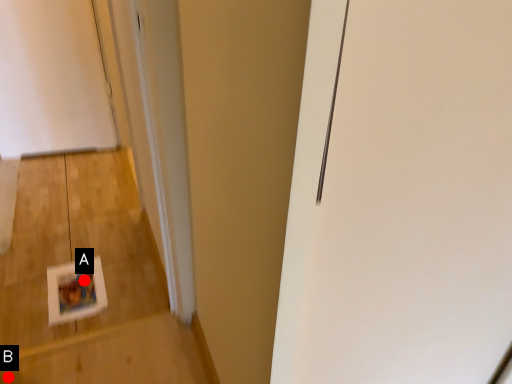
Question: Two points are circled on the image, labeled by A and B beside each circle. Among these points, which one is farthest from the camera?

Choices:
 (A) A is further
 (B) B is further

Answer: (A)